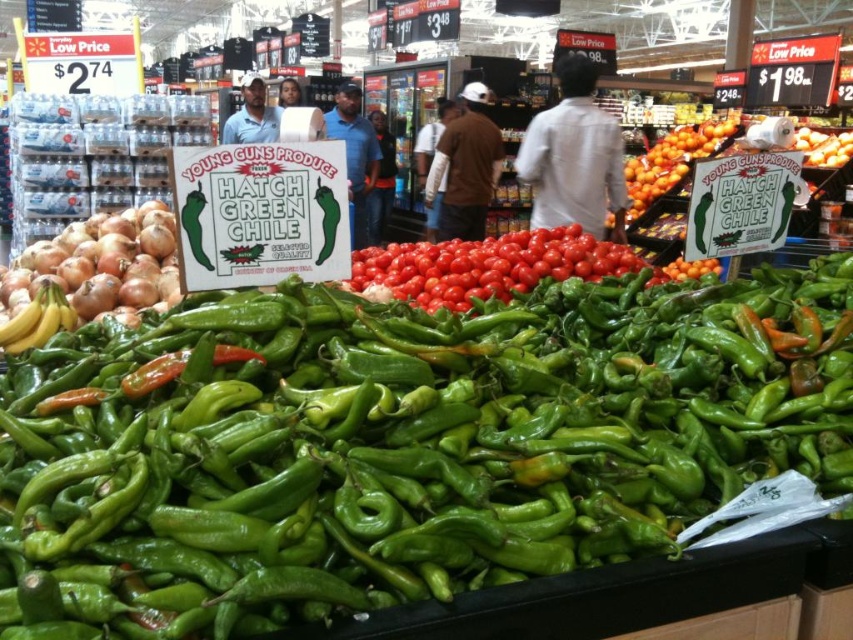
Is point (457, 156) in front of point (346, 156)?

That is False.

Describe the element at coordinates (465, 168) in the screenshot. This screenshot has height=640, width=853. I see `brown cotton shirt at center` at that location.

This screenshot has width=853, height=640. Find the location of `brown cotton shirt at center`. brown cotton shirt at center is located at coordinates (465, 168).

Between brown cotton shirt at center and brown leather jacket at upper center, which one appears on the right side from the viewer's perspective?

brown cotton shirt at center

Which is behind, point (480, 170) or point (428, 134)?

Positioned behind is point (428, 134).

Where is `brown cotton shirt at center`? The image size is (853, 640). brown cotton shirt at center is located at coordinates (465, 168).

Is white matte shirt at center to the left of brown leather jacket at upper center from the viewer's perspective?

Incorrect, white matte shirt at center is not on the left side of brown leather jacket at upper center.

Does white matte shirt at center have a smaller size compared to brown leather jacket at upper center?

Correct, white matte shirt at center occupies less space than brown leather jacket at upper center.

Does point (595, 180) come in front of point (424, 160)?

Yes, it is in front of point (424, 160).

Find the location of a particular element. white matte shirt at center is located at coordinates (573, 157).